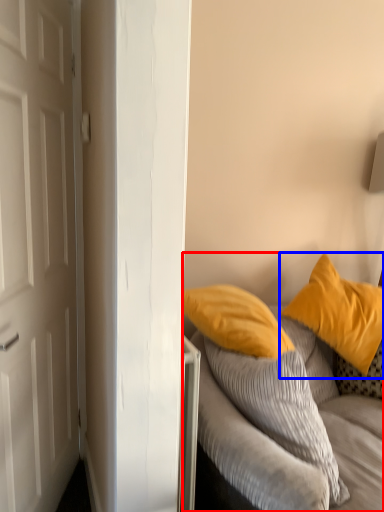
Question: Which object appears farthest to the camera in this image, studio couch (highlighted by a red box) or pillow (highlighted by a blue box)?

Choices:
 (A) studio couch
 (B) pillow

Answer: (B)